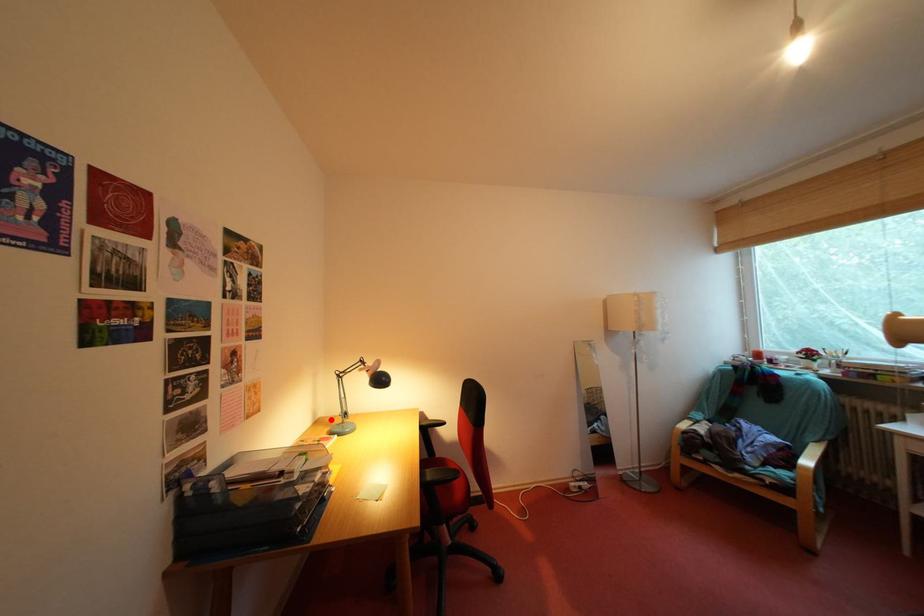
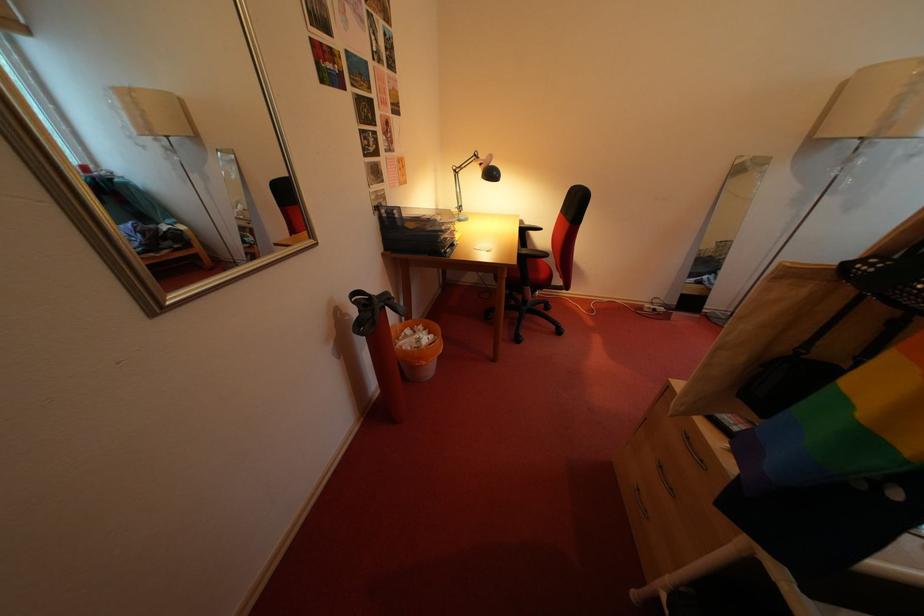
Question: I am providing you with two images of the same scene from different viewpoints. A red point is marked on the first image. Is the red point's position out of view in image 2?

Choices:
 (A) Yes
 (B) No

Answer: (B)